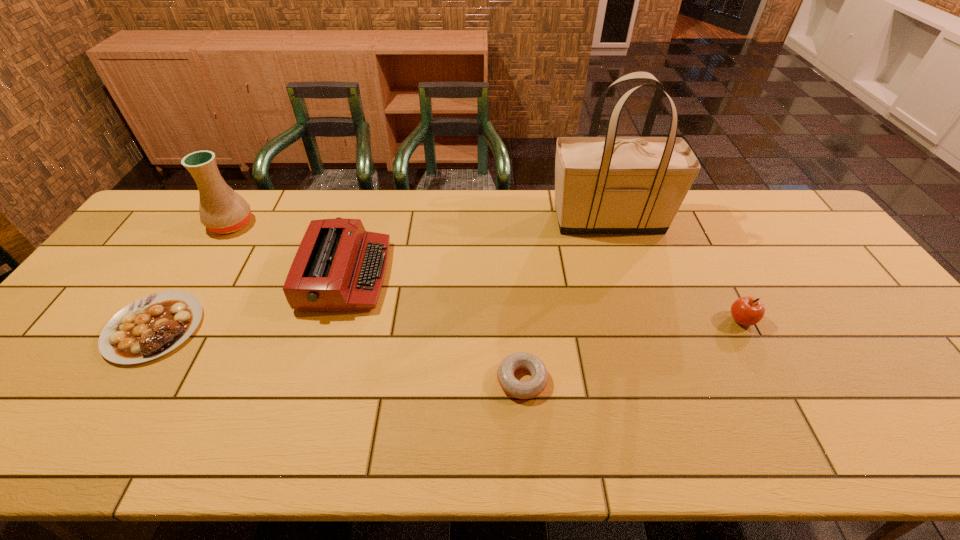
Locate an element on the screen. free region located 0.080m on the right of the pottery is located at coordinates point(278,224).

Find the location of a particular element. blank space located on the typing side of the third object from left to right is located at coordinates (516, 275).

Where is `blank space located on the back of the apple`? blank space located on the back of the apple is located at coordinates click(716, 272).

Identify the location of vacant region located 0.110m on the right of the steak. This screenshot has width=960, height=540. (243, 328).

Locate an element on the screen. free location located 0.060m on the left of the fourth object from left to right is located at coordinates (471, 380).

Where is `shopping bag that is at the far edge`? shopping bag that is at the far edge is located at coordinates (610, 184).

Identify the location of pottery positioned at the far edge. (222, 210).

Where is `object situated at the left edge`? This screenshot has height=540, width=960. object situated at the left edge is located at coordinates pyautogui.click(x=152, y=326).

Where is `vacant space at the far edge`? vacant space at the far edge is located at coordinates (744, 203).

You are a GUI agent. You are given a task and a screenshot of the screen. Output one action in this format:
    pyautogui.click(x=<x>, y=<y>)
    Task: Click on the blank space at the near edge
    
    Given the screenshot: What is the action you would take?
    [111, 429]